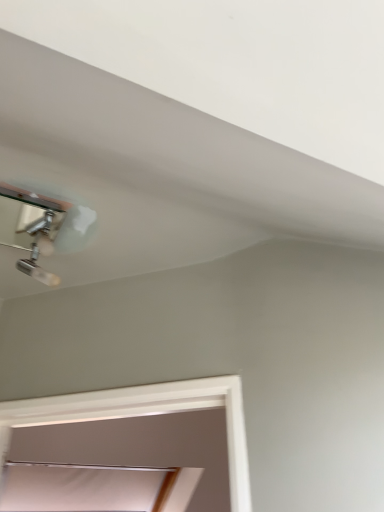
Question: Considering the positions of point (57, 282) and point (56, 509), is point (57, 282) closer or farther from the camera than point (56, 509)?

Choices:
 (A) farther
 (B) closer

Answer: (B)

Question: Is chrome metallic lamp at upper left taller or shorter than white matte window at lower center?

Choices:
 (A) short
 (B) tall

Answer: (A)

Question: Looking at the image, does chrome metallic lamp at upper left seem bigger or smaller compared to white matte window at lower center?

Choices:
 (A) big
 (B) small

Answer: (B)

Question: In the image, is white matte window at lower center positioned in front of or behind chrome metallic lamp at upper left?

Choices:
 (A) behind
 (B) front

Answer: (A)

Question: Is white matte window at lower center inside the boundaries of chrome metallic lamp at upper left, or outside?

Choices:
 (A) inside
 (B) outside

Answer: (B)

Question: In terms of height, does white matte window at lower center look taller or shorter compared to chrome metallic lamp at upper left?

Choices:
 (A) tall
 (B) short

Answer: (A)

Question: In terms of width, does white matte window at lower center look wider or thinner when compared to chrome metallic lamp at upper left?

Choices:
 (A) thin
 (B) wide

Answer: (B)